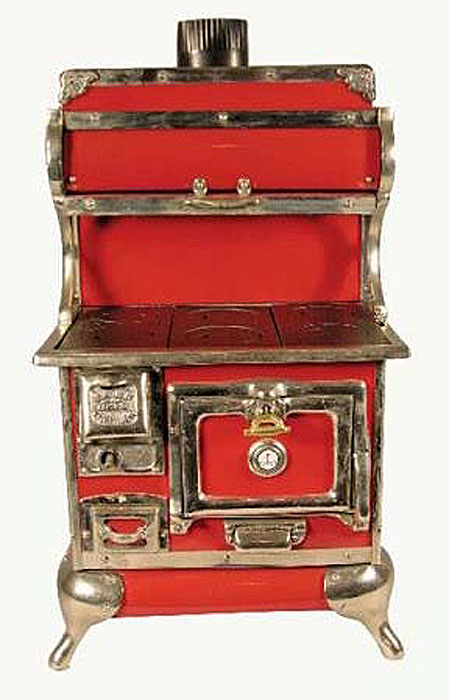
Locate an element on the screen. This screenshot has width=449, height=700. minature stove is located at coordinates (211, 332).